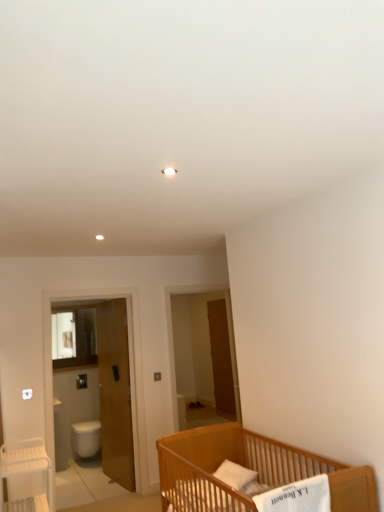
Question: Is light brown wooden crib at lower right to the right of brown wooden screen door at center, placed as the 2th screen door when sorted from left to right, from the viewer's perspective?

Choices:
 (A) yes
 (B) no

Answer: (B)

Question: Is brown wooden screen door at center, positioned as the first screen door in right-to-left order, completely or partially inside light brown wooden crib at lower right?

Choices:
 (A) yes
 (B) no

Answer: (B)

Question: Considering the relative sizes of light brown wooden crib at lower right and brown wooden screen door at center, the 2th screen door when ordered from front to back, in the image provided, is light brown wooden crib at lower right wider than brown wooden screen door at center, the 2th screen door when ordered from front to back,?

Choices:
 (A) yes
 (B) no

Answer: (A)

Question: Considering the relative sizes of light brown wooden crib at lower right and brown wooden screen door at center, positioned as the first screen door in right-to-left order, in the image provided, is light brown wooden crib at lower right bigger than brown wooden screen door at center, positioned as the first screen door in right-to-left order,?

Choices:
 (A) yes
 (B) no

Answer: (A)

Question: Is light brown wooden crib at lower right touching brown wooden screen door at center, which ranks as the first screen door in back-to-front order?

Choices:
 (A) no
 (B) yes

Answer: (A)

Question: Can you confirm if light brown wooden crib at lower right is taller than brown wooden screen door at center, the 2th screen door when ordered from front to back?

Choices:
 (A) yes
 (B) no

Answer: (B)

Question: From the image's perspective, is brown wooden screen door at center, the 2th screen door when ordered from front to back, below wooden door at left?

Choices:
 (A) yes
 (B) no

Answer: (A)

Question: Considering the relative sizes of brown wooden screen door at center, which ranks as the first screen door in back-to-front order, and wooden door at left in the image provided, is brown wooden screen door at center, which ranks as the first screen door in back-to-front order, wider than wooden door at left?

Choices:
 (A) no
 (B) yes

Answer: (A)

Question: From a real-world perspective, is brown wooden screen door at center, which ranks as the first screen door in back-to-front order, beneath wooden door at left?

Choices:
 (A) yes
 (B) no

Answer: (B)

Question: Can you confirm if brown wooden screen door at center, the 2th screen door when ordered from front to back, is bigger than wooden door at left?

Choices:
 (A) yes
 (B) no

Answer: (B)

Question: Is brown wooden screen door at center, the 2th screen door when ordered from front to back, next to wooden door at left?

Choices:
 (A) no
 (B) yes

Answer: (A)

Question: Is the position of brown wooden screen door at center, placed as the 2th screen door when sorted from left to right, more distant than that of wooden door at left?

Choices:
 (A) yes
 (B) no

Answer: (A)

Question: Can you confirm if white glossy screen door at left, marked as the first screen door in a front-to-back arrangement, is positioned to the left of white plastic table at lower left?

Choices:
 (A) yes
 (B) no

Answer: (B)